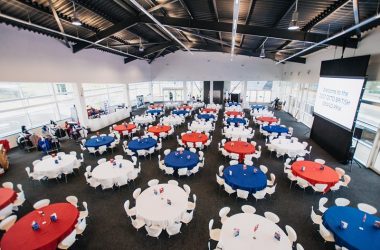
The width and height of the screenshot is (380, 250). I want to click on long table, so [108, 119].